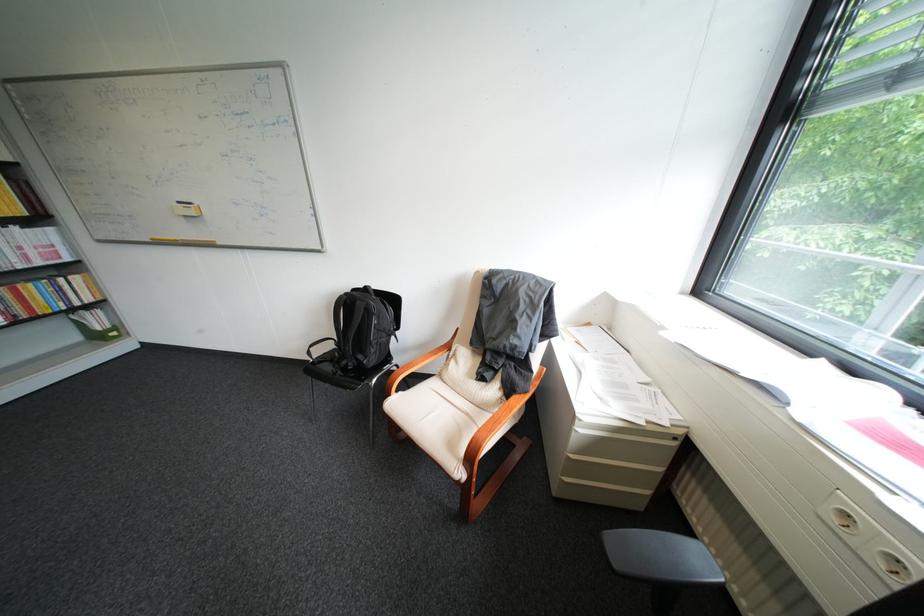
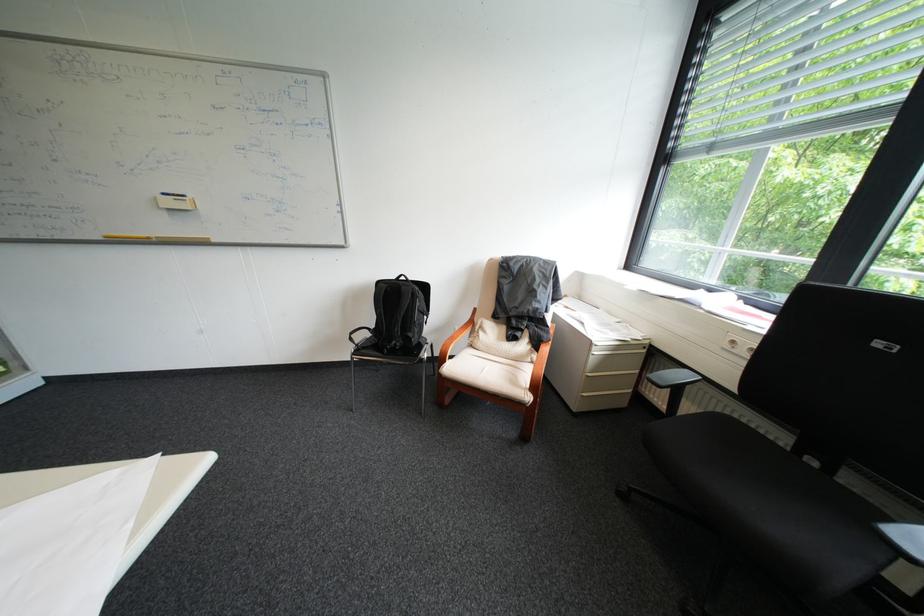
The point at [191,203] is marked in the first image. Where is the corresponding point in the second image?

(176, 195)